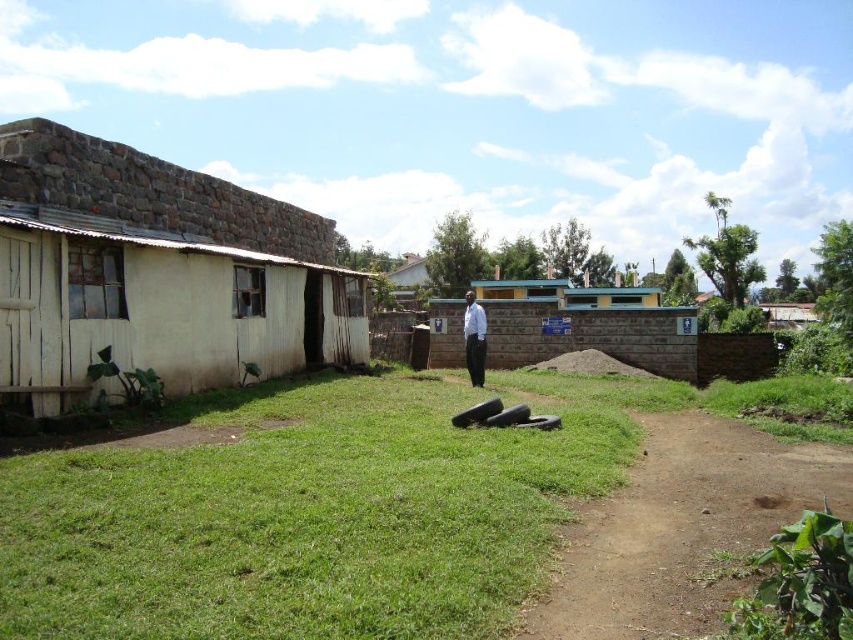
You are standing at the edge of the rural scene and want to reach the green grass at center. According to the coordinates provided, in which direction should you move from your current position?

The green grass at center is located at point coordinates, so you should move towards the center of the image to reach it.

You are standing in the rural area shown in the image. There is a green concrete toilet at center and a white shirt at center. Which object is positioned to the right of the other?

The green concrete toilet at center is to the right of white shirt at center.

You are standing in the rural scene and want to move from the green grass at center to the white stone hut at left. Which direction should you move in?

You should move to the left to go from the green grass at center to the white stone hut at left since the green grass at center is to the right of the white stone hut at left.